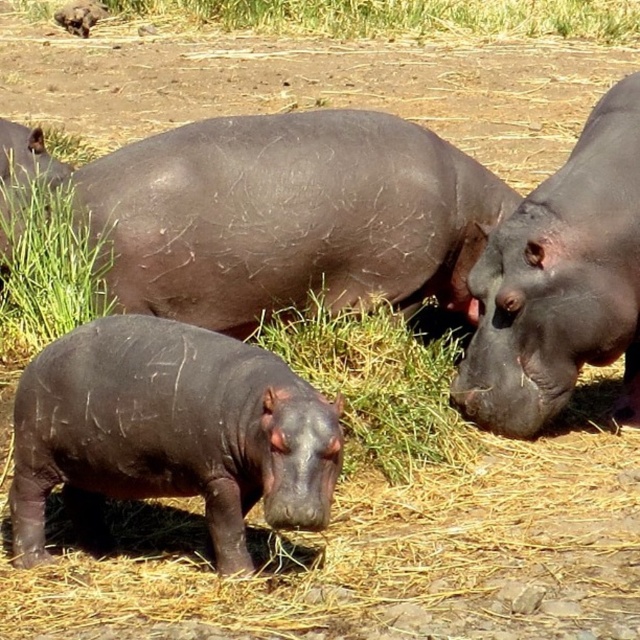
You are standing at the origin point of the coordinate system. Which direction should you move to reach the matte dark brown hippo at center?

The matte dark brown hippo at center is located at point 0.338 in the x direction and 0.450 in the y direction. Since you are at the origin, you should move 0.338 units to the right and 0.450 units forward to reach it.

You are a safari guide leading a group near the hippos. You need to point out the shiny dark brown hippo at lower left to your group. Which direction should you direct them to look relative to the matte dark brown hippo at center?

The shiny dark brown hippo at lower left is located behind the matte dark brown hippo at center, so you should direct your group to look behind the matte dark brown hippo at center to find it.

You are standing at the center of the image and want to move towards the green grass at lower left. Which direction should you face to walk directly towards it?

You should face the lower left direction to walk directly towards the green grass at lower left since it is located at point (45, 268), which is in the lower left area of the image.